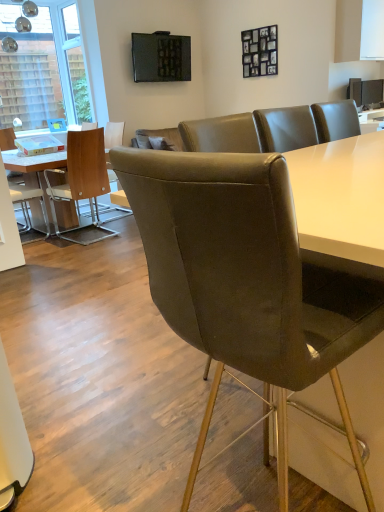
Question: Is white leather chair at left, the 1th chair when ordered from left to right, inside the boundaries of brown leather chair at center, which appears as the 3th chair when viewed from the left, or outside?

Choices:
 (A) inside
 (B) outside

Answer: (B)

Question: In terms of width, does white leather chair at left, the 1th chair when ordered from left to right, look wider or thinner when compared to brown leather chair at center, the 1th chair from the right?

Choices:
 (A) thin
 (B) wide

Answer: (A)

Question: Which object is positioned farthest from the matte brown chair at left, the second chair when ordered from back to front?

Choices:
 (A) matte black tv at upper center, which is counted as the first television, starting from the top
 (B) brown leather chair at center, which appears as the 3th chair when viewed from the left
 (C) matte black tv at upper center, positioned as the 2th television in left-to-right order
 (D) white leather chair at left, placed as the first chair when sorted from back to front
 (E) transparent glass window at upper left

Answer: (B)

Question: Which object is positioned closest to the white leather chair at left, placed as the first chair when sorted from back to front?

Choices:
 (A) matte brown chair at left, placed as the 2th chair when sorted from front to back
 (B) transparent glass window at upper left
 (C) matte black tv at upper center, the first television from the right
 (D) matte black tv at upper center, which is counted as the first television, starting from the top
 (E) brown leather chair at center, which is counted as the 3th chair, starting from the back

Answer: (A)